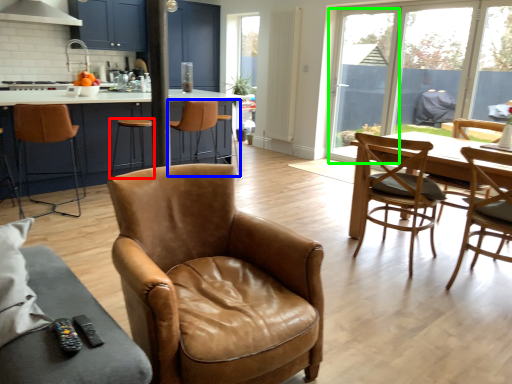
Question: Which object is the farthest from stool (highlighted by a red box)? Choose among these: chair (highlighted by a blue box) or window screen (highlighted by a green box).

Choices:
 (A) chair
 (B) window screen

Answer: (B)